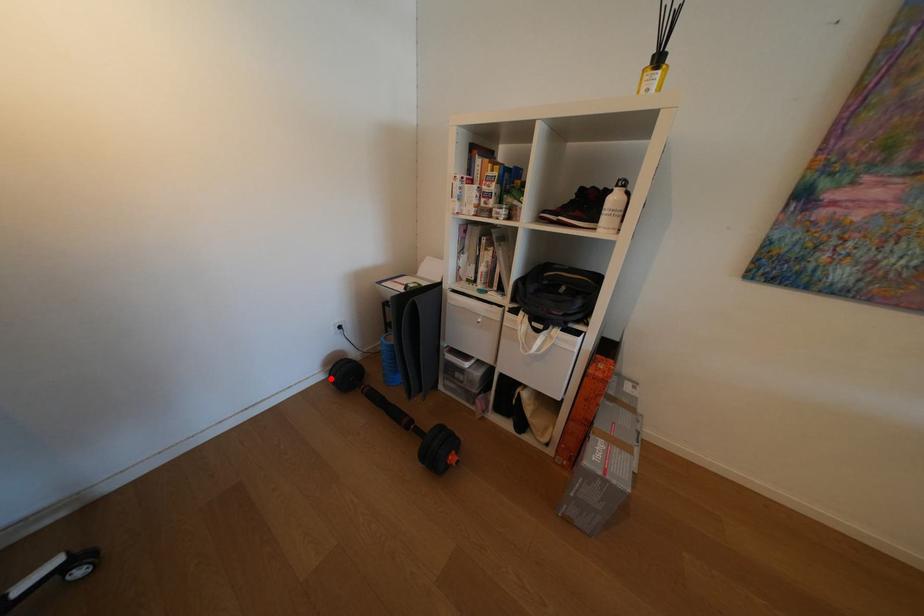
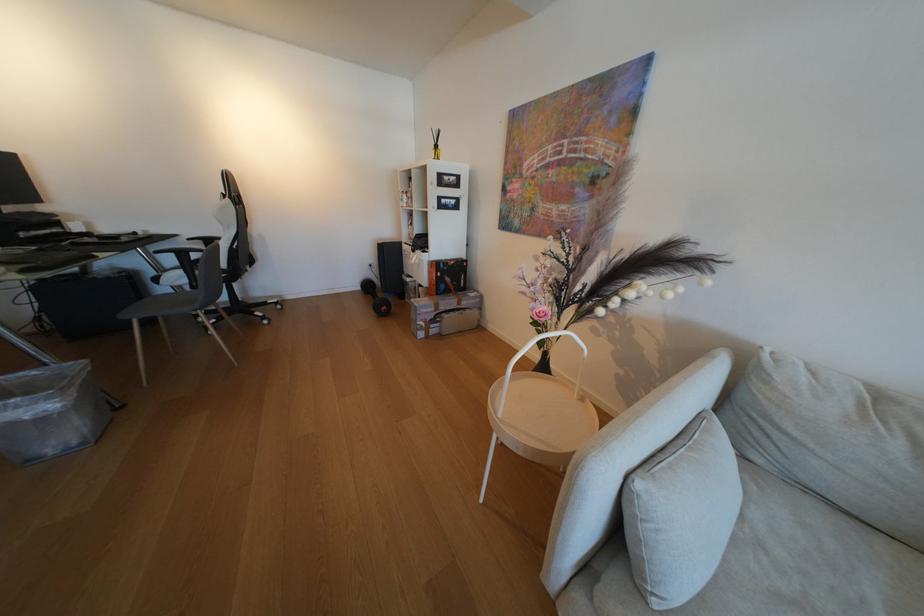
Question: I am providing you with two images of the same scene from different viewpoints. Image1 has a red point marked. In image2, the corresponding 3D location appears at what relative position? Reply with the corresponding letter.

Choices:
 (A) Closer
 (B) Farther

Answer: (B)